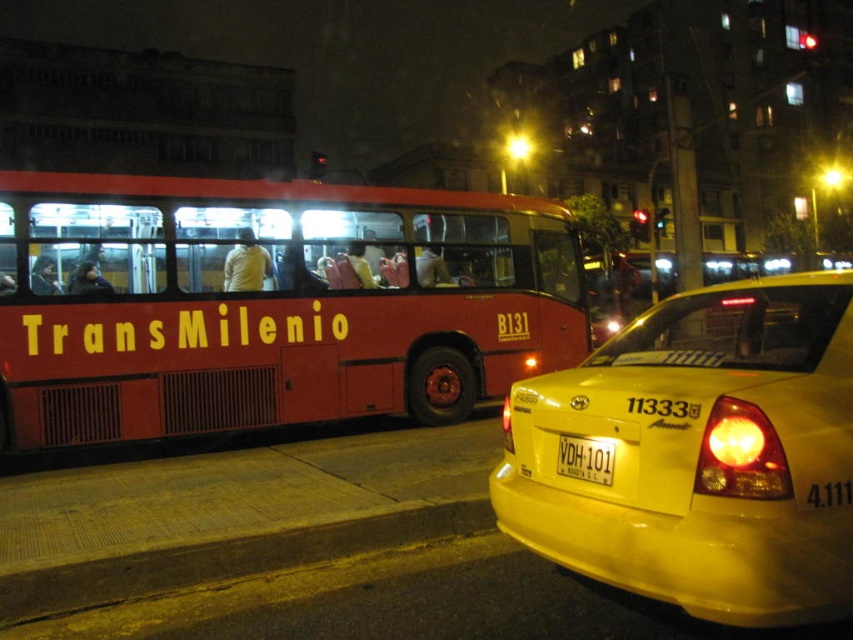
You are a city planner analyzing traffic flow. You need to determine if the yellow plastic license plate at center can be easily read from the red matte transmilenio bus at left. Based on their sizes, what do you conclude?

The red matte transmilenio bus at left is bigger than yellow plastic license plate at center, so the license plate may be difficult to read from the bus due to its smaller size.

You are a pedestrian standing at the curb and want to cross the street to reach the yellow plastic license plate at center. Which direction should you walk to avoid the yellow asphalt curb at lower left?

You should walk to the right of the yellow asphalt curb at lower left to reach the yellow plastic license plate at center since the yellow asphalt curb at lower left is to the left of yellow plastic license plate at center.

What does the point at coordinates (270, 304) represent in the image?

The point at coordinates (270, 304) indicates the red matte transmilenio bus at left.